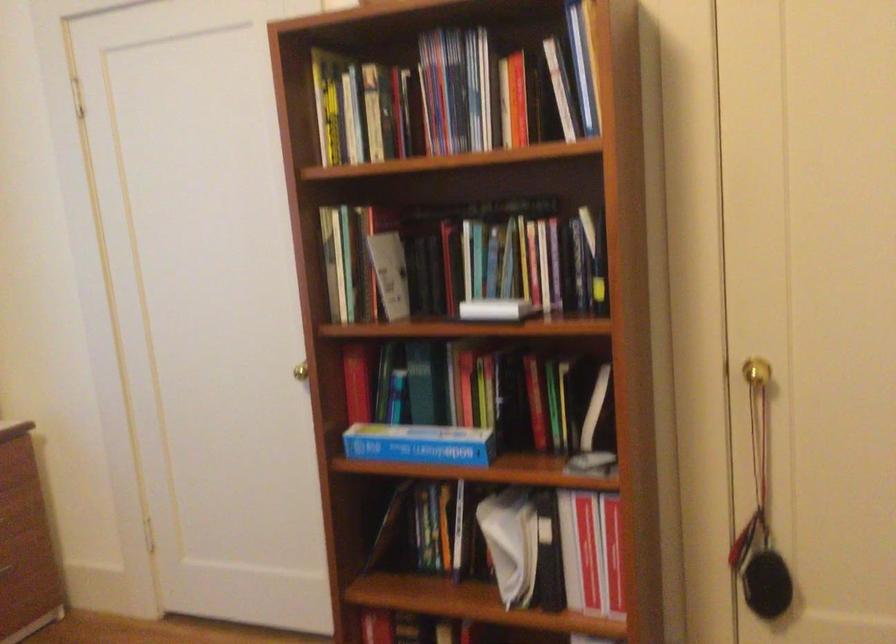
Where is `white binder`? white binder is located at coordinates (570, 552).